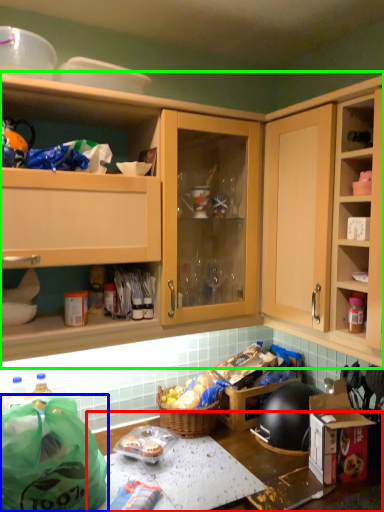
Question: Which object is positioned farthest from table (highlighted by a red box)? Select from bag (highlighted by a blue box) and cabinetry (highlighted by a green box).

Choices:
 (A) bag
 (B) cabinetry

Answer: (B)